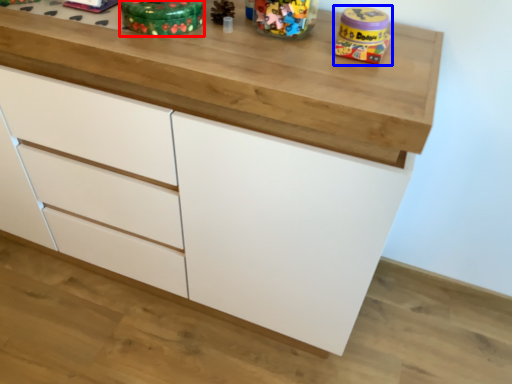
Question: Which point is closer to the camera, toy (highlighted by a red box) or toy (highlighted by a blue box)?

Choices:
 (A) toy
 (B) toy

Answer: (A)